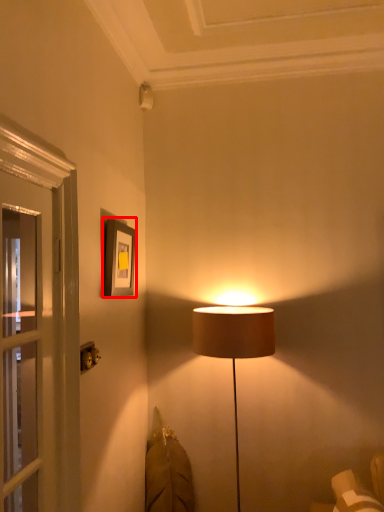
Question: Considering the relative positions of picture frame (annotated by the red box) and electric outlet in the image provided, where is picture frame (annotated by the red box) located with respect to the staircase?

Choices:
 (A) right
 (B) left

Answer: (A)